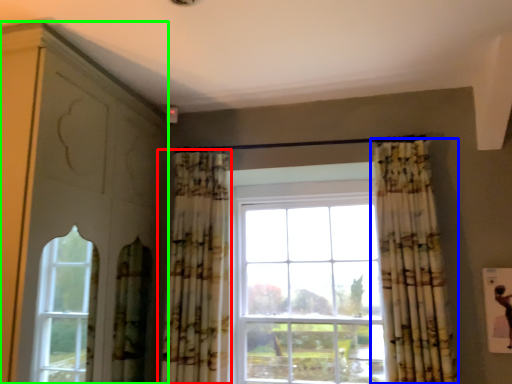
Question: Which object is positioned closest to curtain (highlighted by a red box)? Select from curtain (highlighted by a blue box) and dresser (highlighted by a green box).

Choices:
 (A) curtain
 (B) dresser

Answer: (B)